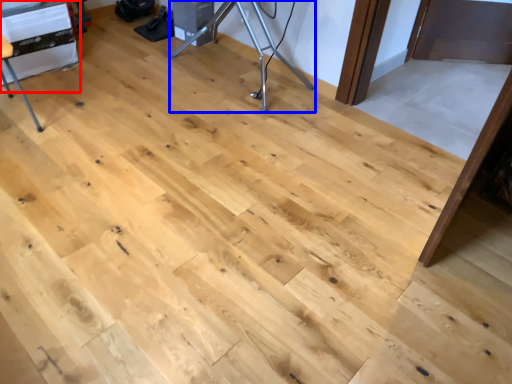
Question: Which of the following is the farthest to the observer, table (highlighted by a red box) or tripod (highlighted by a blue box)?

Choices:
 (A) table
 (B) tripod

Answer: (B)